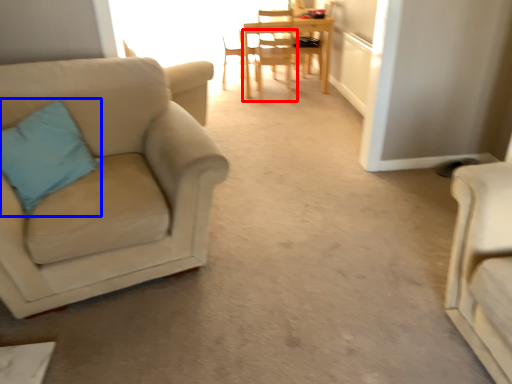
Question: Among these objects, which one is nearest to the camera, chair (highlighted by a red box) or pillow (highlighted by a blue box)?

Choices:
 (A) chair
 (B) pillow

Answer: (B)